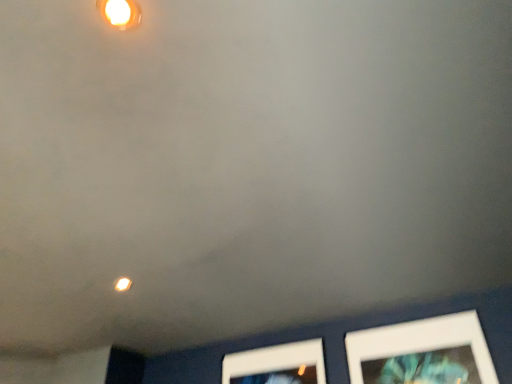
I want to click on matte yellow light at upper left, so click(x=123, y=284).

Find the location of `matte white light fixture at upper center`. matte white light fixture at upper center is located at coordinates (120, 13).

Considering the positions of objects matte white light fixture at upper center and white matte picture frame at lower right in the image provided, who is behind, matte white light fixture at upper center or white matte picture frame at lower right?

white matte picture frame at lower right is behind.

From the image's perspective, between matte white light fixture at upper center and white matte picture frame at lower right, which one is located above?

From the image's view, matte white light fixture at upper center is above.

Can you confirm if matte white light fixture at upper center is positioned to the left of white matte picture frame at lower right?

Yes.

What are the coordinates of `picture frame behind the matte white light fixture at upper center` in the screenshot? It's located at (422, 352).

Is white matte picture frame at lower right oriented towards matte white light fixture at upper center?

Yes, white matte picture frame at lower right is turned towards matte white light fixture at upper center.

From a real-world perspective, which object rests below the other?

In real-world perspective, white matte picture frame at lower right is lower.

Consider the image. Which of these two, white matte picture frame at lower right or matte white light fixture at upper center, stands shorter?

matte white light fixture at upper center is shorter.

Relative to matte white light fixture at upper center, is white matte picture frame at lower right in front or behind?

In the image, white matte picture frame at lower right appears behind matte white light fixture at upper center.

Between matte yellow light at upper left and matte white light fixture at upper center, which one has more height?

With more height is matte yellow light at upper left.

Who is bigger, matte yellow light at upper left or matte white light fixture at upper center?

matte yellow light at upper left is bigger.

In order to click on light fixture below the matte yellow light at upper left (from a real-world perspective) in this screenshot , I will do `click(120, 13)`.

Are matte yellow light at upper left and matte white light fixture at upper center beside each other?

No, matte yellow light at upper left is not with matte white light fixture at upper center.

Is matte yellow light at upper left to the right of white matte picture frame at lower right from the viewer's perspective?

Incorrect, matte yellow light at upper left is not on the right side of white matte picture frame at lower right.

Does matte yellow light at upper left turn towards white matte picture frame at lower right?

No, matte yellow light at upper left is not facing towards white matte picture frame at lower right.

Looking at this image, is matte yellow light at upper left in contact with white matte picture frame at lower right?

There is a gap between matte yellow light at upper left and white matte picture frame at lower right.

How many degrees apart are the facing directions of matte yellow light at upper left and white matte picture frame at lower right?

The angle between the facing direction of matte yellow light at upper left and the facing direction of white matte picture frame at lower right is 107 degrees.

Between matte white light fixture at upper center and matte yellow light at upper left, which one appears on the left side from the viewer's perspective?

matte yellow light at upper left is more to the left.

Is matte white light fixture at upper center positioned far away from matte yellow light at upper left?

Yes, matte white light fixture at upper center and matte yellow light at upper left are located far from each other.

Which of these two, matte white light fixture at upper center or matte yellow light at upper left, is thinner?

Thinner between the two is matte white light fixture at upper center.

From a real-world perspective, who is located lower, matte white light fixture at upper center or matte yellow light at upper left?

From a 3D spatial view, matte white light fixture at upper center is below.

Can you confirm if white matte picture frame at lower right is smaller than matte yellow light at upper left?

No, white matte picture frame at lower right is not smaller than matte yellow light at upper left.

Is white matte picture frame at lower right far from matte yellow light at upper left?

Yes, white matte picture frame at lower right and matte yellow light at upper left are quite far apart.

What's the angular difference between white matte picture frame at lower right and matte yellow light at upper left's facing directions?

107 degrees.

Is white matte picture frame at lower right to the right of matte yellow light at upper left from the viewer's perspective?

Yes.

Locate an element on the screen. The image size is (512, 384). light fixture above the white matte picture frame at lower right (from the image's perspective) is located at coordinates (120, 13).

This screenshot has width=512, height=384. I want to click on picture frame located below the matte white light fixture at upper center (from the image's perspective), so click(x=422, y=352).

Looking at the image, which one is located closer to matte yellow light at upper left, matte white light fixture at upper center or white matte picture frame at lower right?

matte white light fixture at upper center is positioned closer to the anchor matte yellow light at upper left.

From the image, which object appears to be farther from matte white light fixture at upper center, white matte picture frame at lower right or matte yellow light at upper left?

white matte picture frame at lower right is positioned further to the anchor matte white light fixture at upper center.

Looking at this image, considering their positions, is matte white light fixture at upper center positioned closer to white matte picture frame at lower right than matte yellow light at upper left?

matte yellow light at upper left.

From the image, which object appears to be farther from matte white light fixture at upper center, matte yellow light at upper left or white matte picture frame at lower right?

white matte picture frame at lower right lies further to matte white light fixture at upper center than the other object.

Which object lies nearer to the anchor point white matte picture frame at lower right, matte yellow light at upper left or matte white light fixture at upper center?

Based on the image, matte yellow light at upper left appears to be nearer to white matte picture frame at lower right.

Looking at the image, which one is located further to matte yellow light at upper left, white matte picture frame at lower right or matte white light fixture at upper center?

white matte picture frame at lower right is positioned further to the anchor matte yellow light at upper left.

Find the location of `light fixture located between matte yellow light at upper left and white matte picture frame at lower right in the left-right direction`. light fixture located between matte yellow light at upper left and white matte picture frame at lower right in the left-right direction is located at coordinates (120, 13).